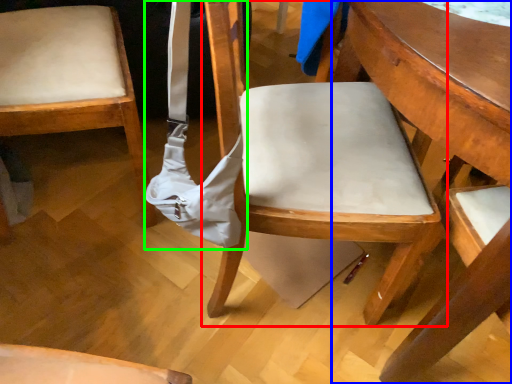
Question: Estimate the real-world distances between objects in this image. Which object is farther from chair (highlighted by a red box), table (highlighted by a blue box) or shoulder bag (highlighted by a green box)?

Choices:
 (A) table
 (B) shoulder bag

Answer: (A)